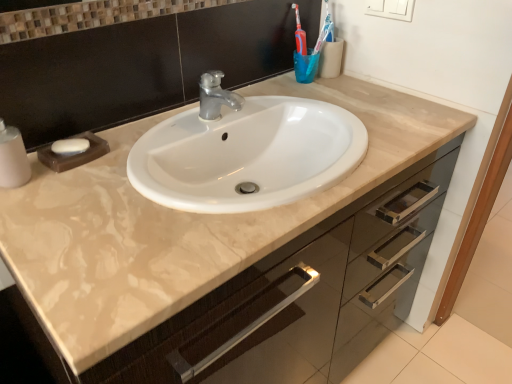
The image size is (512, 384). What do you see at coordinates (322, 38) in the screenshot?
I see `translucent blue cup at upper right` at bounding box center [322, 38].

You are a GUI agent. You are given a task and a screenshot of the screen. Output one action in this format:
    pyautogui.click(x=<x>, y=<y>)
    Task: Click on the translucent blue cup at upper right
    This screenshot has height=384, width=512.
    Given the screenshot: What is the action you would take?
    pyautogui.click(x=322, y=38)

What do you see at coordinates (70, 146) in the screenshot? I see `white matte soap at left` at bounding box center [70, 146].

What is the approximate width of white matte soap at left?

It is 2.27 inches.

In order to click on white matte soap at left in this screenshot , I will do `click(70, 146)`.

In order to face white matte soap at left, should I rotate leftwards or rightwards?

A 23.580 degree turn to the left will do.

Find the location of a particular element. The image size is (512, 384). translucent blue cup at upper right is located at coordinates (322, 38).

Visually, is white matte soap at left positioned to the left or to the right of translucent blue cup at upper right?

In the image, white matte soap at left appears on the left side of translucent blue cup at upper right.

Considering the relative positions of white matte soap at left and translucent blue cup at upper right in the image provided, is white matte soap at left behind translucent blue cup at upper right?

No, white matte soap at left is closer to the camera.

Which point is more forward, (88, 144) or (326, 7)?

Point (88, 144)

From the image's perspective, is white matte soap at left positioned above or below translucent blue cup at upper right?

white matte soap at left is situated lower than translucent blue cup at upper right in the image.

From a real-world perspective, between white matte soap at left and translucent blue cup at upper right, who is vertically lower?

white matte soap at left, from a real-world perspective.

Considering the sizes of objects white matte soap at left and translucent blue cup at upper right in the image provided, who is wider, white matte soap at left or translucent blue cup at upper right?

With larger width is white matte soap at left.

Considering the sizes of white matte soap at left and translucent blue cup at upper right in the image, is white matte soap at left taller or shorter than translucent blue cup at upper right?

Considering their sizes, white matte soap at left has less height than translucent blue cup at upper right.

Between white matte soap at left and translucent blue cup at upper right, which one has larger size?

translucent blue cup at upper right.

Is white matte soap at left outside of translucent blue cup at upper right?

Yes.

Is white matte soap at left touching translucent blue cup at upper right?

white matte soap at left is not next to translucent blue cup at upper right, and they're not touching.

Could you tell me if white matte soap at left is turned towards translucent blue cup at upper right?

No, white matte soap at left is not facing towards translucent blue cup at upper right.

What's the angular difference between white matte soap at left and translucent blue cup at upper right's facing directions?

They differ by 25.2 degrees in their facing directions.

Find the location of a particular element. This screenshot has width=512, height=384. toothbrush that appears above the white matte soap at left (from a real-world perspective) is located at coordinates (322, 38).

Can you confirm if translucent blue cup at upper right is positioned to the left of white matte soap at left?

No.

Is translucent blue cup at upper right positioned behind white matte soap at left?

Yes, the depth of translucent blue cup at upper right is greater than that of white matte soap at left.

Between point (321, 39) and point (67, 143), which one is positioned in front?

The point (67, 143) is closer.

From the image's perspective, is translucent blue cup at upper right positioned above or below white matte soap at left?

Based on their image positions, translucent blue cup at upper right is located above white matte soap at left.

From a real-world perspective, which is physically above, translucent blue cup at upper right or white matte soap at left?

translucent blue cup at upper right, from a real-world perspective.

Can you confirm if translucent blue cup at upper right is thinner than white matte soap at left?

Yes.

From their relative heights in the image, would you say translucent blue cup at upper right is taller or shorter than white matte soap at left?

translucent blue cup at upper right is taller than white matte soap at left.

Who is smaller, translucent blue cup at upper right or white matte soap at left?

Smaller between the two is white matte soap at left.

Is translucent blue cup at upper right not inside white matte soap at left?

translucent blue cup at upper right lies outside white matte soap at left's area.

In the scene shown: Are translucent blue cup at upper right and white matte soap at left far apart?

translucent blue cup at upper right is actually quite close to white matte soap at left.

Is translucent blue cup at upper right aimed at white matte soap at left?

No, translucent blue cup at upper right is not facing towards white matte soap at left.

How different are the orientations of translucent blue cup at upper right and white matte soap at left in degrees?

They differ by 25.2 degrees in their facing directions.

How far apart are translucent blue cup at upper right and white matte soap at left?

translucent blue cup at upper right is 76.43 centimeters away from white matte soap at left.

Identify the location of soap below the translucent blue cup at upper right (from the image's perspective). This screenshot has height=384, width=512. [70, 146].

Identify the location of toothbrush located above the white matte soap at left (from a real-world perspective). Image resolution: width=512 pixels, height=384 pixels. (322, 38).

Identify the location of soap below the translucent blue cup at upper right (from a real-world perspective). The width and height of the screenshot is (512, 384). (70, 146).